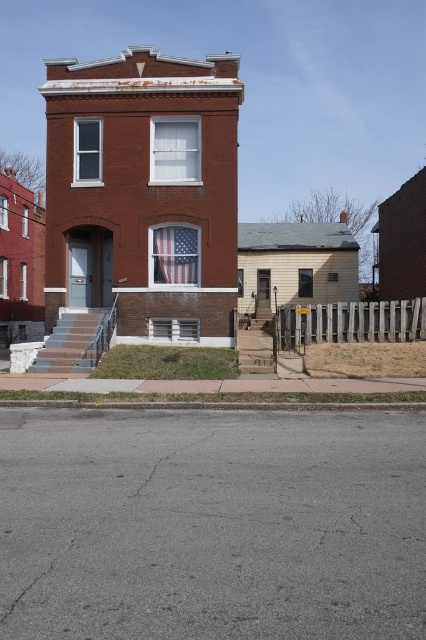
You are a delivery person approaching the building and need to park your van. The van requires a parking spot that is at least 5 meters long. The gray concrete curb at lower center is in front of the american flag at center. Can you park your van between the curb and the flag without blocking the flag?

The gray concrete curb at lower center is in front of the american flag at center, meaning there is space between them. However, the distance between them isn t specified. Without knowing the exact distance, it s impossible to confirm if it s at least 5 meters. You should measure the space before deciding to park there.

You are a delivery person trying to park your van in front of the two story brick building. The van requires a space of 10 meters to park safely. You see the gray concrete curb at lower center and the american flag at center. Can you determine if the space between them is sufficient for your van?

The gray concrete curb at lower center is 8.33 meters from the american flag at center. Since the van requires 10 meters to park safely, the space between them is insufficient for parking the van safely.